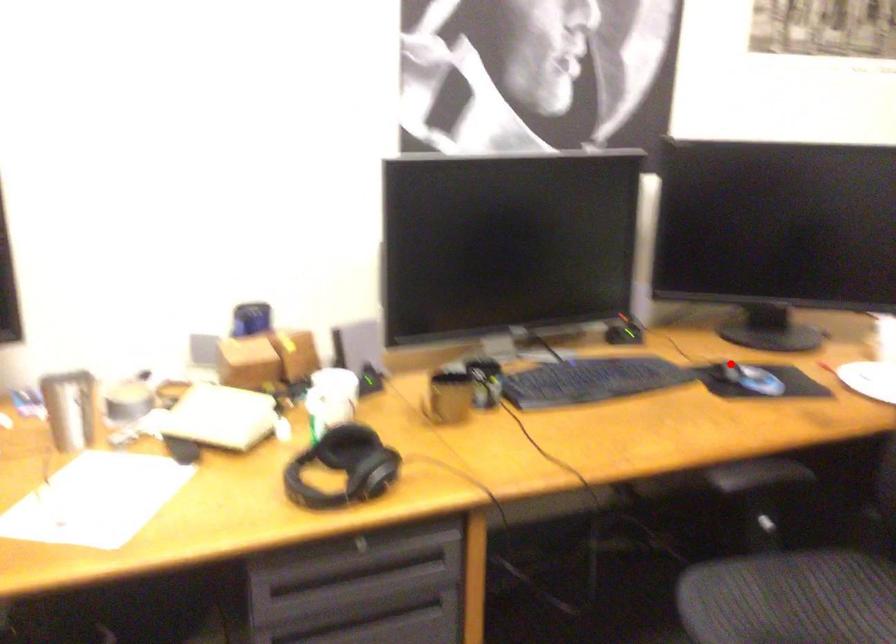
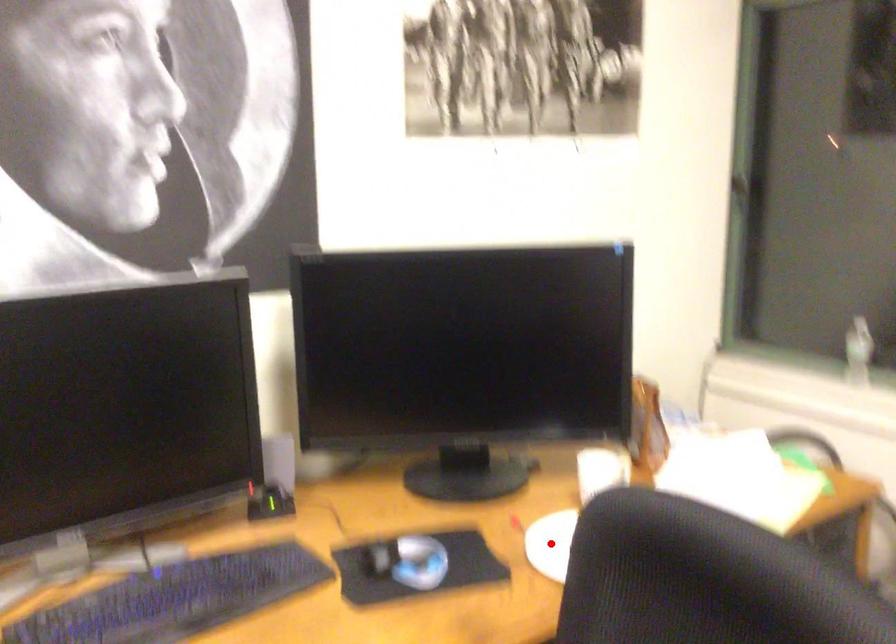
I am providing you with two images of the same scene from different viewpoints. A red point is marked on the first image and another point is marked on the second image. Do the highlighted points in image1 and image2 indicate the same real-world spot?

No